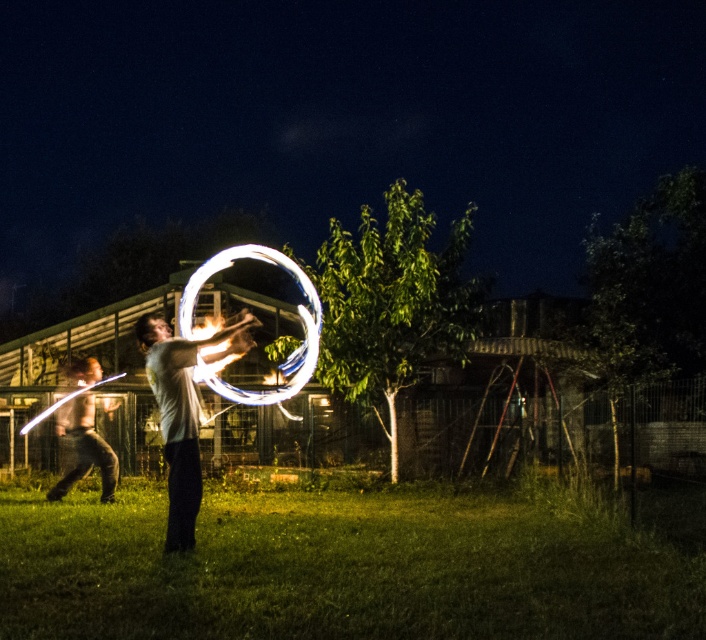
Does green grass at center have a smaller size compared to matte white shirt at center?

No.

Who is more forward, [52,561] or [54,497]?

Point [52,561]

In order to click on green grass at center in this screenshot , I will do `click(340, 564)`.

Measure the distance between white glossy hula hoop at center and matte white shirt at center.

They are 5.61 meters apart.

Does white glossy hula hoop at center have a smaller size compared to matte white shirt at center?

Incorrect, white glossy hula hoop at center is not smaller in size than matte white shirt at center.

Between point (189, 541) and point (112, 476), which one is positioned in front?

Point (189, 541) is in front.

The image size is (706, 640). I want to click on white glossy hula hoop at center, so click(181, 410).

Which is more to the left, green grass at center or white glossy hula hoop at center?

Positioned to the left is white glossy hula hoop at center.

Does green grass at center appear over white glossy hula hoop at center?

No.

Identify the location of green grass at center. (340, 564).